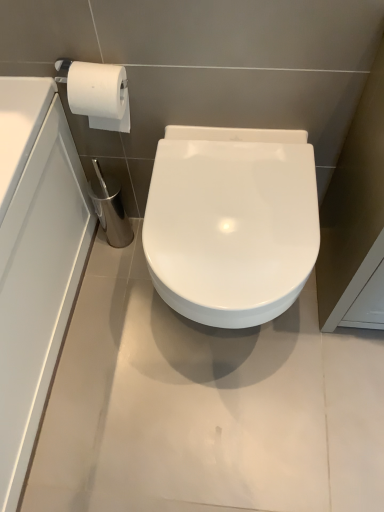
Describe the element at coordinates (231, 222) in the screenshot. This screenshot has height=512, width=384. I see `white glossy toilet at center` at that location.

What is the approximate height of white glossy toilet at center?

It is 18.78 inches.

Where is `white glossy toilet at center`? The height and width of the screenshot is (512, 384). white glossy toilet at center is located at coordinates (231, 222).

In order to click on white glossy toilet at center in this screenshot , I will do `click(231, 222)`.